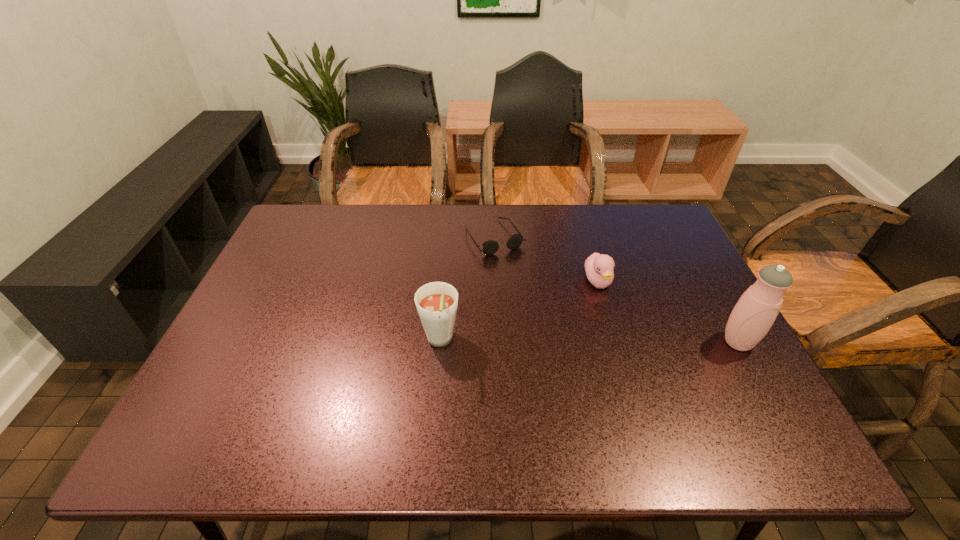
At what (x,y) coordinates should I click in order to perform the action: click on vacant area at the near left corner. Please return your answer as a coordinate pair (x, y). The image size is (960, 540). Looking at the image, I should click on tap(247, 402).

Image resolution: width=960 pixels, height=540 pixels. Find the location of `vacant space at the far right corner of the desktop`. vacant space at the far right corner of the desktop is located at coordinates (647, 236).

The height and width of the screenshot is (540, 960). I want to click on vacant space that's between the rightmost object and the third tallest object, so click(668, 312).

Where is `free point between the rightmost object and the root beer`? The width and height of the screenshot is (960, 540). free point between the rightmost object and the root beer is located at coordinates (588, 342).

The width and height of the screenshot is (960, 540). Identify the location of free point between the root beer and the thermos bottle. (588, 342).

In order to click on vacant space in between the thermos bottle and the second tallest object in this screenshot , I will do `click(588, 342)`.

Where is `free space between the shortest object and the tallest object`? Image resolution: width=960 pixels, height=540 pixels. free space between the shortest object and the tallest object is located at coordinates coord(616,290).

Find the location of a particular element. unoccupied position between the rightmost object and the farthest object is located at coordinates (616, 290).

I want to click on free space between the thermos bottle and the shortest object, so click(x=616, y=290).

Where is `vacant space that is in between the thermos bottle and the second farthest object`? The width and height of the screenshot is (960, 540). vacant space that is in between the thermos bottle and the second farthest object is located at coordinates (668, 312).